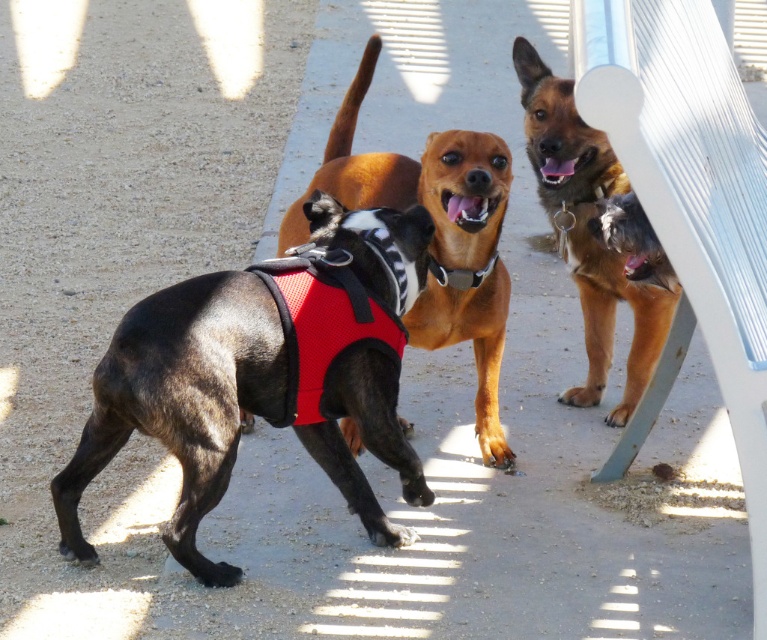
Question: Can you confirm if black and white harness at center is wider than brown fur dog at upper right?

Choices:
 (A) no
 (B) yes

Answer: (B)

Question: Is black mesh vest at center positioned behind brown fur dog at upper right?

Choices:
 (A) yes
 (B) no

Answer: (B)

Question: Which point is farther from the camera taking this photo?

Choices:
 (A) (170, 397)
 (B) (514, 70)
 (C) (430, 260)
 (D) (433, 157)

Answer: (B)

Question: Which of the following is the farthest from the observer?

Choices:
 (A) (193, 564)
 (B) (453, 230)

Answer: (B)

Question: Which of the following is the closest to the observer?

Choices:
 (A) (147, 381)
 (B) (410, 332)

Answer: (A)

Question: Is black mesh vest at center to the right of black fabric neckband at center from the viewer's perspective?

Choices:
 (A) yes
 (B) no

Answer: (B)